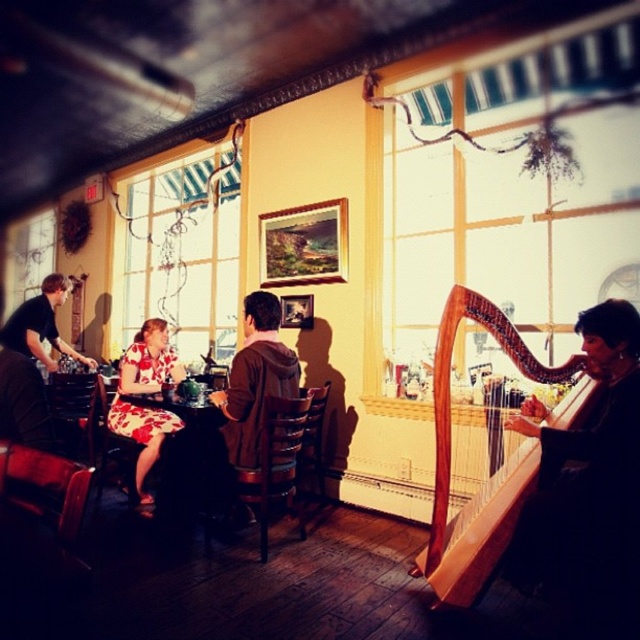
You are standing in the cafe and want to take a photo of the two points. Which point, point (227, 390) or point (138, 493), is closer to you?

Point (227, 390) is closer to the camera than point (138, 493), so it is closer to you.

You are a photographer setting up a shoot in the described scene. You need to position a large tripod between the brown hoodie at center and the floral dress at center. Considering their sizes, which object should the tripod be placed closer to, and why?

The tripod should be placed closer to the brown hoodie at center because it is smaller than the floral dress at center, allowing more space around the larger floral dress.